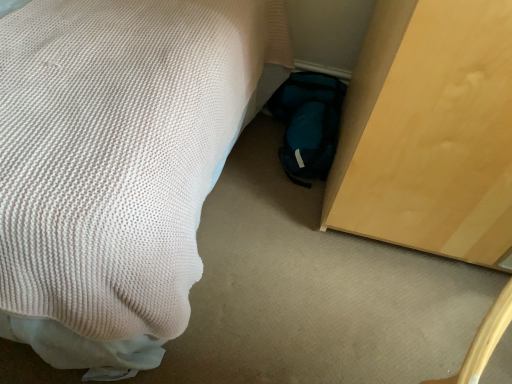
Question: Should I look upward or downward to see white knitted bed at lower left?

Choices:
 (A) down
 (B) up

Answer: (B)

Question: Is white knitted bed at lower left not close to teal fabric bag at lower center?

Choices:
 (A) no
 (B) yes

Answer: (A)

Question: Is white knitted bed at lower left taller than teal fabric bag at lower center?

Choices:
 (A) yes
 (B) no

Answer: (A)

Question: Is white knitted bed at lower left shorter than teal fabric bag at lower center?

Choices:
 (A) yes
 (B) no

Answer: (B)

Question: From the image's perspective, is white knitted bed at lower left located above teal fabric bag at lower center?

Choices:
 (A) yes
 (B) no

Answer: (A)

Question: Is white knitted bed at lower left closer to the viewer compared to teal fabric bag at lower center?

Choices:
 (A) no
 (B) yes

Answer: (B)

Question: Is white knitted bed at lower left at the left side of teal fabric bag at lower center?

Choices:
 (A) yes
 (B) no

Answer: (A)

Question: Does teal fabric bag at lower center appear on the right side of white knitted bed at lower left?

Choices:
 (A) no
 (B) yes

Answer: (B)

Question: Is teal fabric bag at lower center positioned before white knitted bed at lower left?

Choices:
 (A) no
 (B) yes

Answer: (A)

Question: From a real-world perspective, is teal fabric bag at lower center located higher than white knitted bed at lower left?

Choices:
 (A) no
 (B) yes

Answer: (A)

Question: From the image's perspective, is teal fabric bag at lower center beneath white knitted bed at lower left?

Choices:
 (A) no
 (B) yes

Answer: (B)

Question: Can you confirm if teal fabric bag at lower center is bigger than white knitted bed at lower left?

Choices:
 (A) no
 (B) yes

Answer: (A)

Question: Is teal fabric bag at lower center facing away from white knitted bed at lower left?

Choices:
 (A) yes
 (B) no

Answer: (B)

Question: From a real-world perspective, relative to white knitted bed at lower left, is teal fabric bag at lower center vertically above or below?

Choices:
 (A) above
 (B) below

Answer: (B)